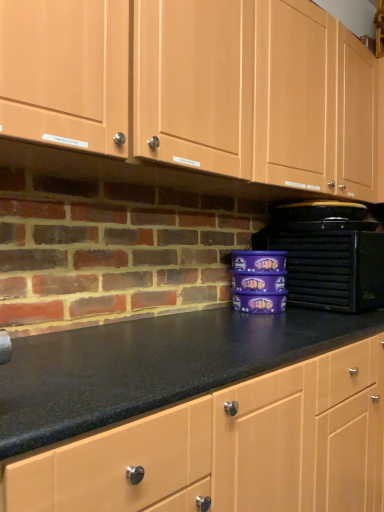
Question: Do you think matte wood cabinets at upper center is within black plastic toaster at right, or outside of it?

Choices:
 (A) outside
 (B) inside

Answer: (A)

Question: From the image's perspective, is matte wood cabinets at upper center above or below black plastic toaster at right?

Choices:
 (A) below
 (B) above

Answer: (B)

Question: Is point (198, 109) closer or farther from the camera than point (369, 229)?

Choices:
 (A) farther
 (B) closer

Answer: (B)

Question: Is black plastic toaster at right situated inside matte wood cabinets at upper center or outside?

Choices:
 (A) outside
 (B) inside

Answer: (A)

Question: In terms of height, does black plastic toaster at right look taller or shorter compared to matte wood cabinets at upper center?

Choices:
 (A) short
 (B) tall

Answer: (A)

Question: In terms of width, does black plastic toaster at right look wider or thinner when compared to matte wood cabinets at upper center?

Choices:
 (A) wide
 (B) thin

Answer: (A)

Question: Relative to matte wood cabinets at upper center, is black plastic toaster at right in front or behind?

Choices:
 (A) behind
 (B) front

Answer: (A)